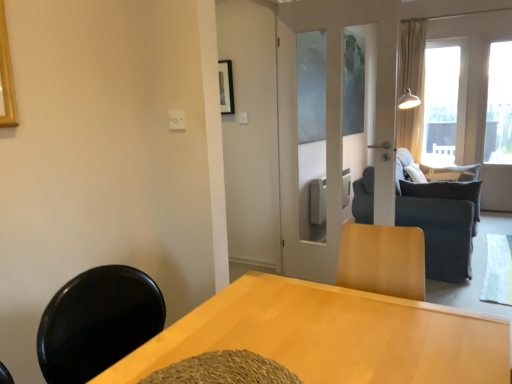
Question: Looking at their shapes, would you say light wood table at center is wider or thinner than beige fabric curtain at right?

Choices:
 (A) thin
 (B) wide

Answer: (B)

Question: From a real-world perspective, is light wood table at center physically located above or below beige fabric curtain at right?

Choices:
 (A) below
 (B) above

Answer: (A)

Question: Which is farther from the dark gray fabric couch at center?

Choices:
 (A) transparent glass window at upper right, which appears as the second window when viewed from the right
 (B) beige fabric curtain at right
 (C) dark gray fabric pillow at right
 (D) transparent glass door at upper right, positioned as the 1th window in right-to-left order
 (E) light wood table at center

Answer: (A)

Question: Estimate the real-world distances between objects in this image. Which object is closer to the transparent glass window at upper right, marked as the first window in a left-to-right arrangement?

Choices:
 (A) dark gray fabric couch at center
 (B) transparent glass door at upper right, positioned as the 1th window in right-to-left order
 (C) light wood table at center
 (D) beige fabric curtain at right
 (E) dark gray fabric pillow at right

Answer: (D)